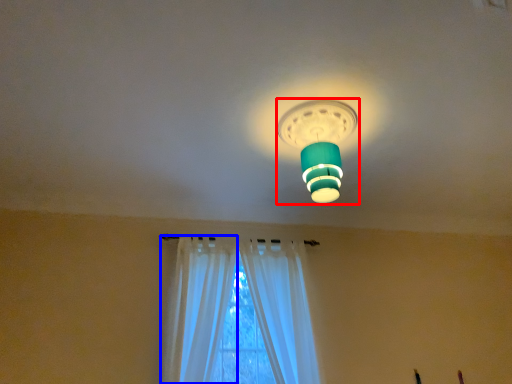
Question: Which object is closer to the camera taking this photo, lamp (highlighted by a red box) or curtain (highlighted by a blue box)?

Choices:
 (A) lamp
 (B) curtain

Answer: (A)